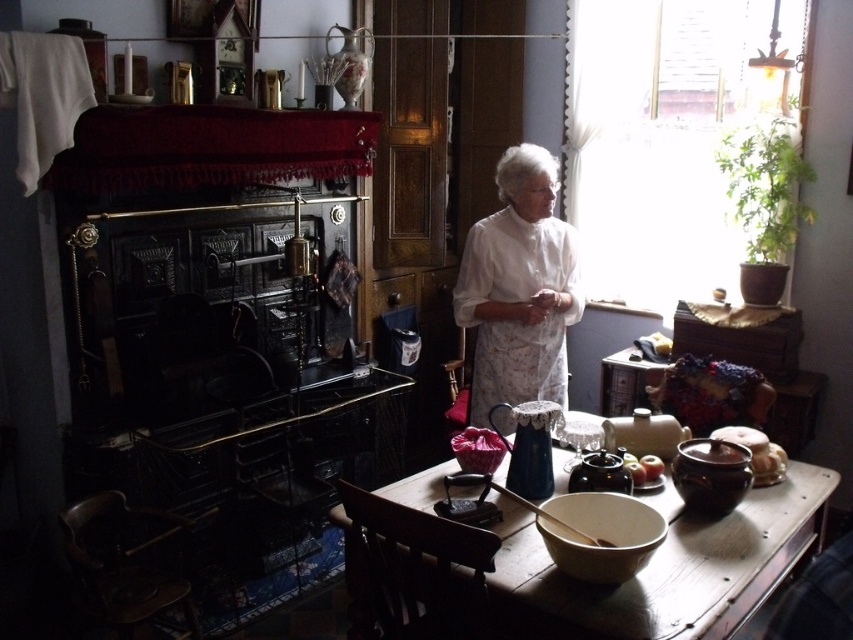
Question: Which of these objects is positioned farthest from the white lace dress at center?

Choices:
 (A) matte wooden table at center
 (B) smooth brown bowl at lower center

Answer: (B)

Question: Which of the following is the closest to the observer?

Choices:
 (A) (735, 525)
 (B) (657, 472)
 (C) (521, 148)

Answer: (A)

Question: Which object is farther from the camera taking this photo?

Choices:
 (A) matte wooden table at center
 (B) smooth brown bowl at lower center
 (C) white lace dress at center

Answer: (C)

Question: Can you confirm if matte wooden table at center is positioned to the right of smooth brown bowl at lower center?

Choices:
 (A) yes
 (B) no

Answer: (B)

Question: Is the position of white lace dress at center more distant than that of smooth brown bowl at lower center?

Choices:
 (A) yes
 (B) no

Answer: (A)

Question: Is matte wooden table at center below white lace dress at center?

Choices:
 (A) yes
 (B) no

Answer: (A)